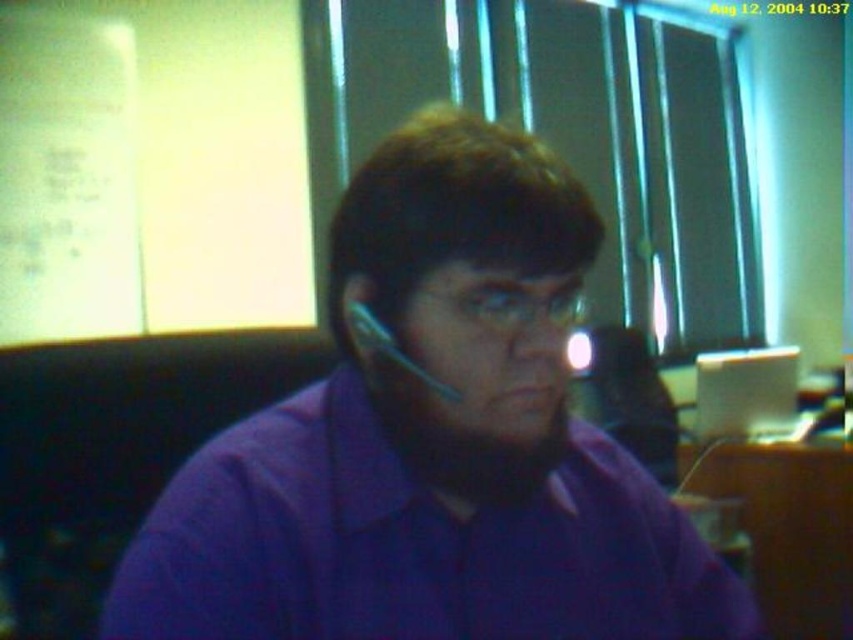
You are organizing a photoshoot and need to ensure that the purple matte shirt at center and the wooden desk at lower right are both visible in the frame. Given their sizes, which object should you prioritize positioning closer to the camera to maintain clarity?

The purple matte shirt at center should be positioned closer to the camera because it is smaller in size compared to the wooden desk at lower right, ensuring it remains clearly visible in the frame.

You are an office worker who needs to adjust the position of the purple matte shirt at center and the white glossy computer at center so that the computer is now to the right of the shirt. Based on their current positions, which object should you move to achieve this?

The purple matte shirt at center is currently on the left side of the white glossy computer at center. To have the computer to the right of the shirt, you should move the white glossy computer at center to the right side of the purple matte shirt at center.